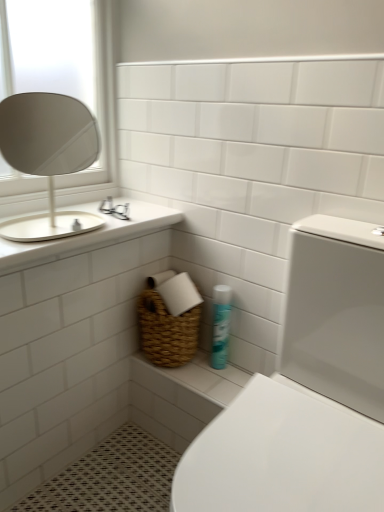
At what (x,y) coordinates should I click in order to perform the action: click on free space above woven basket at lower center (from a real-world perspective). Please return your answer as a coordinate pair (x, y). This screenshot has width=384, height=512. Looking at the image, I should click on (212, 368).